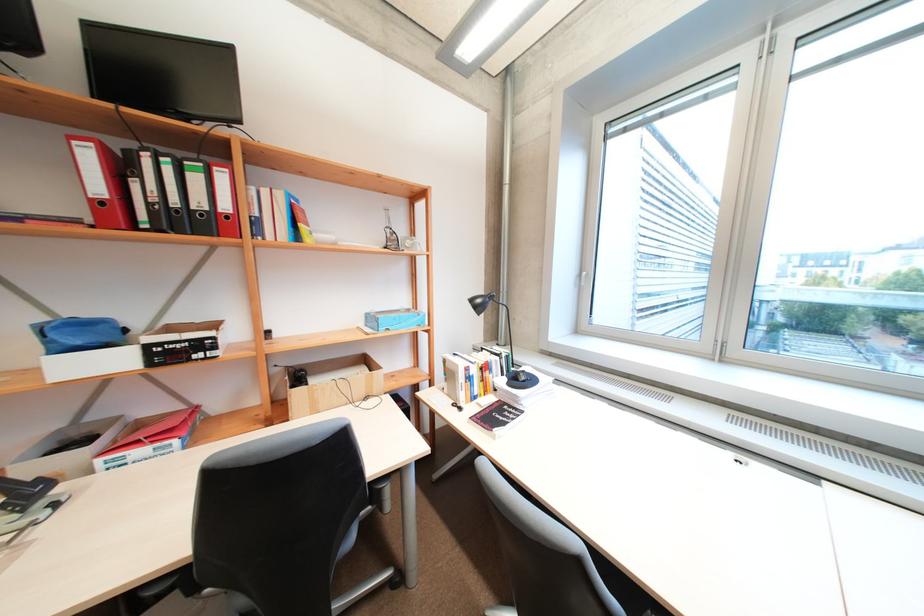
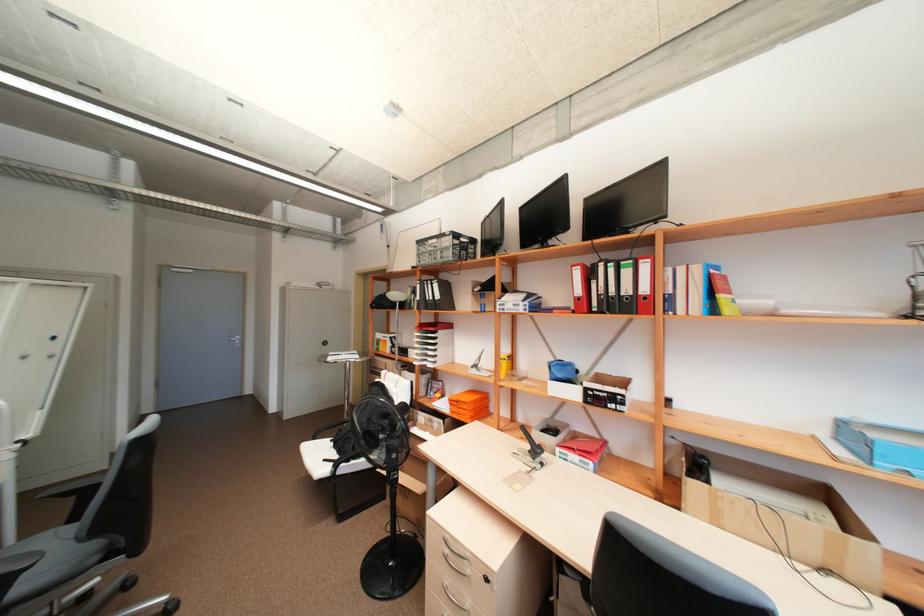
Where in the second image is the point corresponding to pixel 82 432 from the first image?

(557, 424)